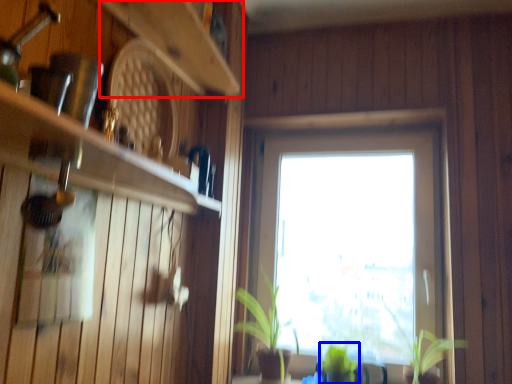
Question: Which object is further to the camera taking this photo, shelf (highlighted by a red box) or plant (highlighted by a blue box)?

Choices:
 (A) shelf
 (B) plant

Answer: (B)